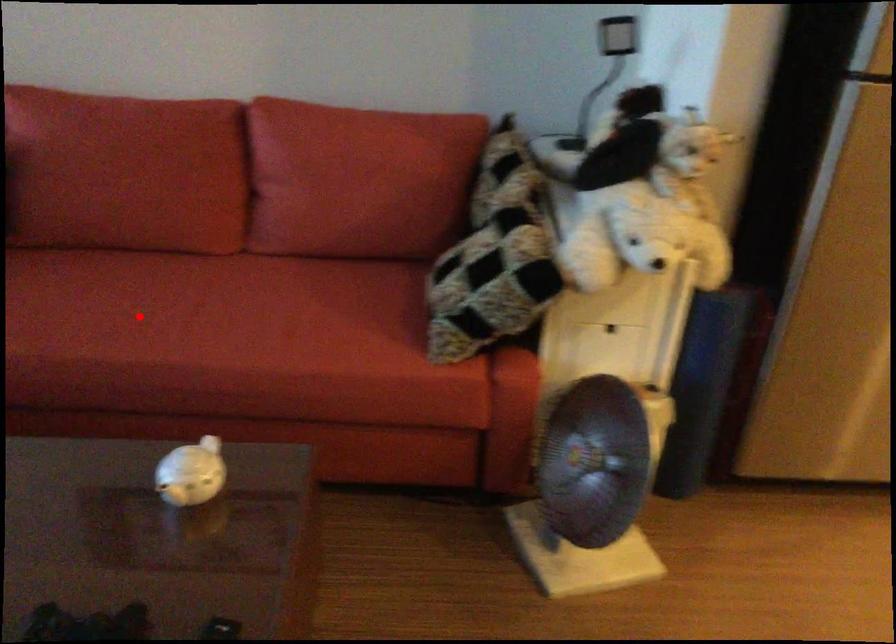
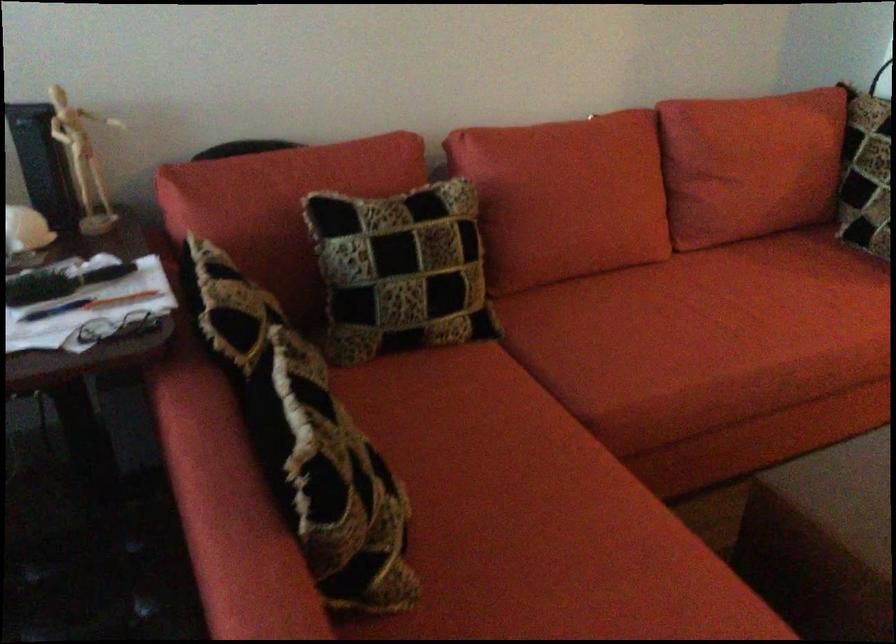
In the second image, find the point that corresponds to the highlighted location in the first image.

(726, 323)